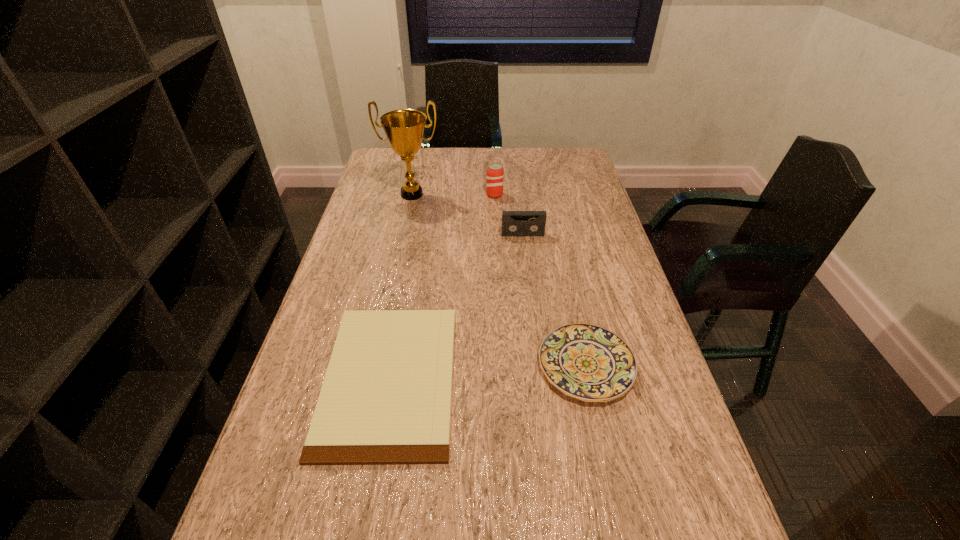
Where is `award`? Image resolution: width=960 pixels, height=540 pixels. award is located at coordinates (404, 128).

Find the location of a particular element. the fourth shortest object is located at coordinates (495, 173).

Where is `the third nearest object`? The image size is (960, 540). the third nearest object is located at coordinates (514, 223).

Identify the location of the third shortest object. The width and height of the screenshot is (960, 540). (514, 223).

Locate an element on the screen. The image size is (960, 540). plate is located at coordinates (588, 362).

Image resolution: width=960 pixels, height=540 pixels. I want to click on the shortest object, so click(386, 397).

Locate an element on the screen. vacant position located on the front view with handles of the award is located at coordinates (396, 265).

Where is `vacant space located on the front of the beer can`? Image resolution: width=960 pixels, height=540 pixels. vacant space located on the front of the beer can is located at coordinates (498, 267).

Locate an element on the screen. vacant region located on the front-facing side of the videotape is located at coordinates (534, 323).

Find the location of `free space located 0.360m on the back of the plate`. free space located 0.360m on the back of the plate is located at coordinates (559, 239).